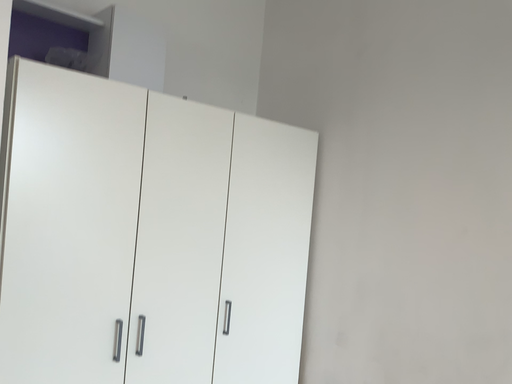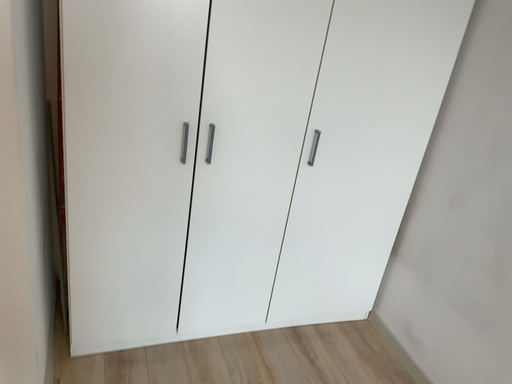
Question: Which way did the camera rotate in the video?

Choices:
 (A) rotated right
 (B) rotated left

Answer: (B)